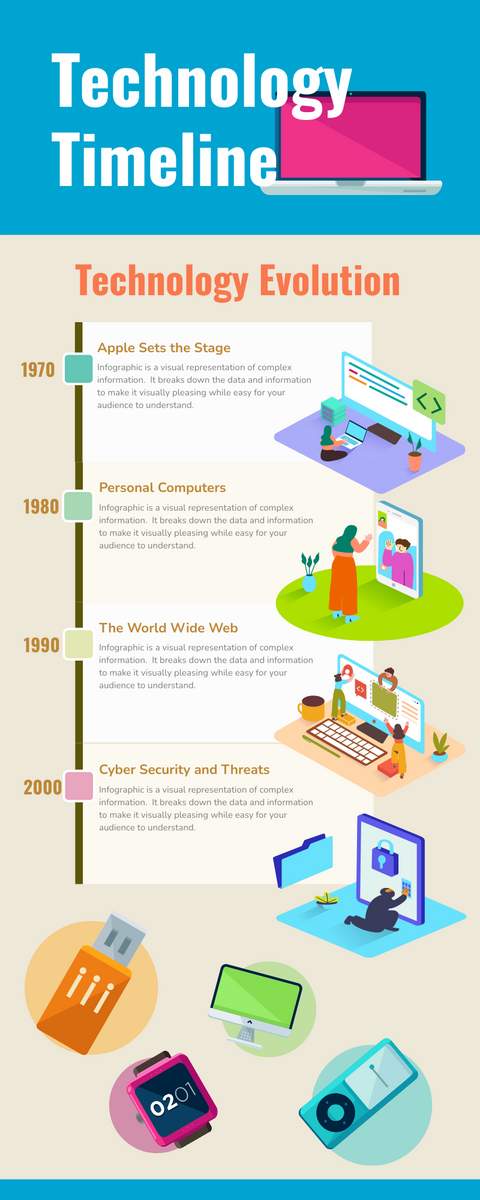
Find the location of a particular element. This screenshot has height=1200, width=480. lock is located at coordinates (391, 864).